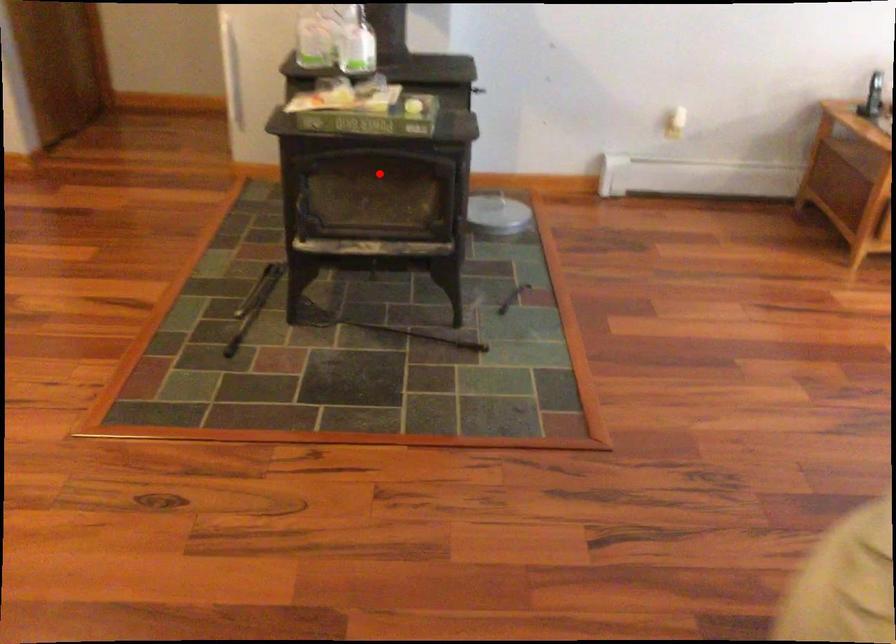
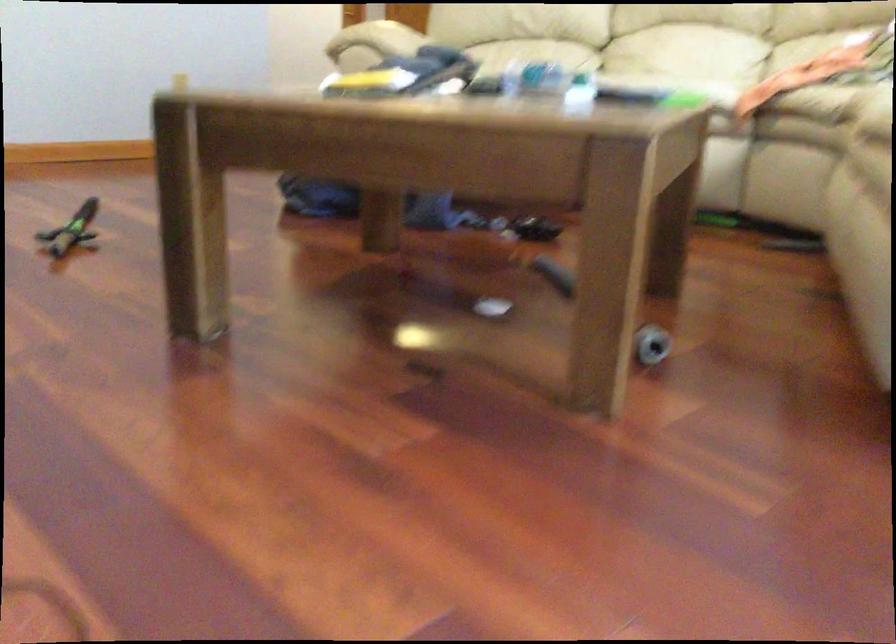
Question: I am providing you with two images of the same scene from different viewpoints. A red point is marked on the first image. Is the red point's position out of view in image 2?

Choices:
 (A) Yes
 (B) No

Answer: (A)